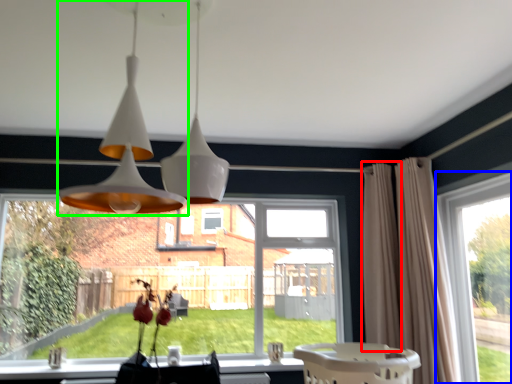
Question: Which object is positioned farthest from curtain (highlighted by a red box)? Select from window (highlighted by a blue box) and lamp (highlighted by a green box).

Choices:
 (A) window
 (B) lamp

Answer: (B)